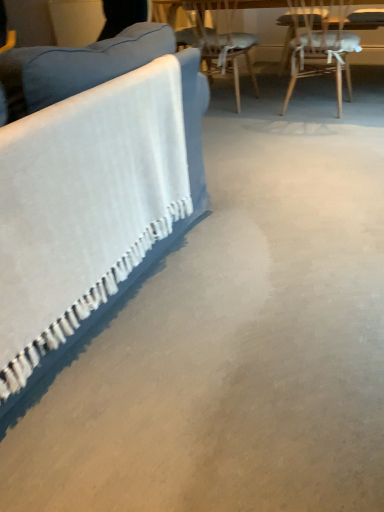
Question: From the image's perspective, is wooden chair at upper right, which ranks as the 2th chair in left-to-right order, above or below blue fabric couch at left?

Choices:
 (A) above
 (B) below

Answer: (A)

Question: Looking at their shapes, would you say wooden chair at upper right, which ranks as the 2th chair in left-to-right order, is wider or thinner than blue fabric couch at left?

Choices:
 (A) wide
 (B) thin

Answer: (B)

Question: Which is nearer to the wooden chair at upper right, placed as the first chair when sorted from right to left?

Choices:
 (A) wooden chair at upper right, arranged as the 1th chair when viewed from the left
 (B) blue fabric couch at left

Answer: (A)

Question: Considering the real-world distances, which object is closest to the blue fabric couch at left?

Choices:
 (A) wooden chair at upper right, placed as the first chair when sorted from right to left
 (B) wooden chair at upper right, arranged as the 1th chair when viewed from the left

Answer: (A)